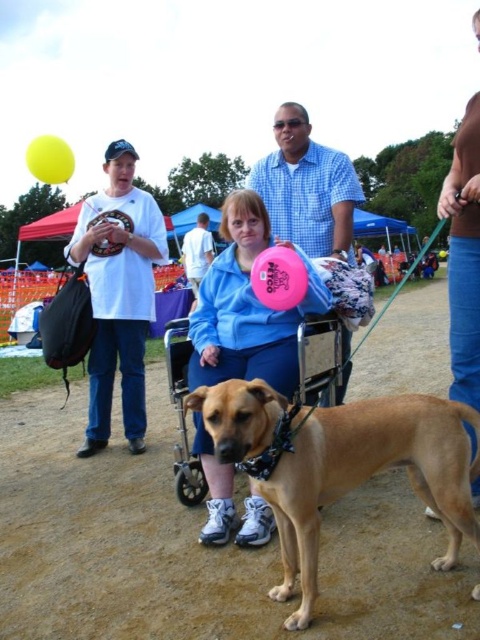
Between matte blue jacket at center and blue checkered shirt at center, which one appears on the left side from the viewer's perspective?

From the viewer's perspective, matte blue jacket at center appears more on the left side.

Who is more forward, (213, 346) or (292, 198)?

Point (213, 346) is more forward.

Locate an element on the screen. Image resolution: width=480 pixels, height=640 pixels. matte blue jacket at center is located at coordinates (242, 308).

Which is more to the right, blue fleece jacket at center or blue fabric shirt at center?

blue fleece jacket at center is more to the right.

Who is shorter, blue fleece jacket at center or blue fabric shirt at center?

Standing shorter between the two is blue fabric shirt at center.

The width and height of the screenshot is (480, 640). What are the coordinates of `blue fleece jacket at center` in the screenshot? It's located at (464, 256).

Is brown leather dog at center thinner than matte blue jacket at center?

Incorrect, brown leather dog at center's width is not less than matte blue jacket at center's.

Does brown leather dog at center have a smaller size compared to matte blue jacket at center?

Yes.

Who is more forward, [254,404] or [239,257]?

Point [254,404] is in front.

Locate an element on the screen. The width and height of the screenshot is (480, 640). brown leather dog at center is located at coordinates (370, 476).